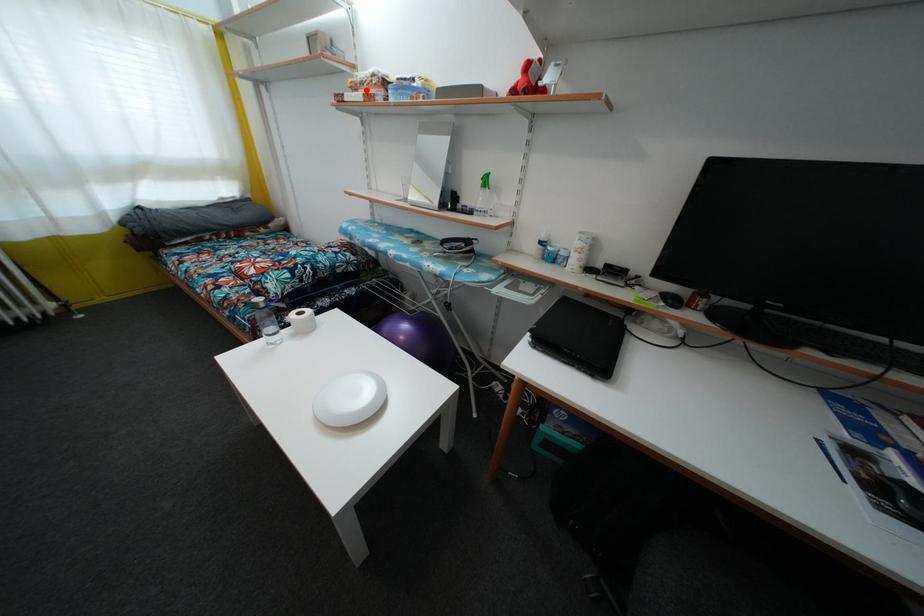
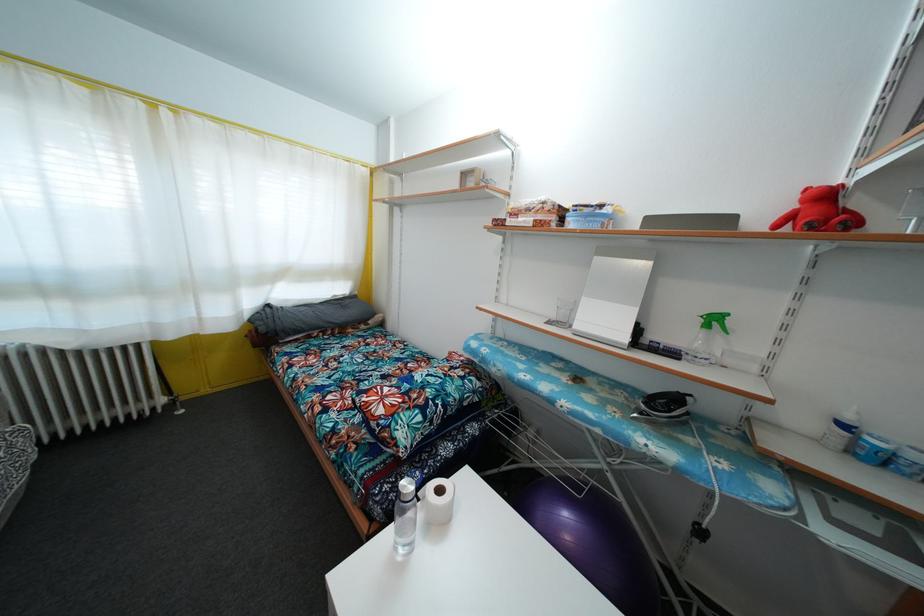
Locate, in the second image, the point that corresponds to the highlighted location in the first image.

(531, 216)